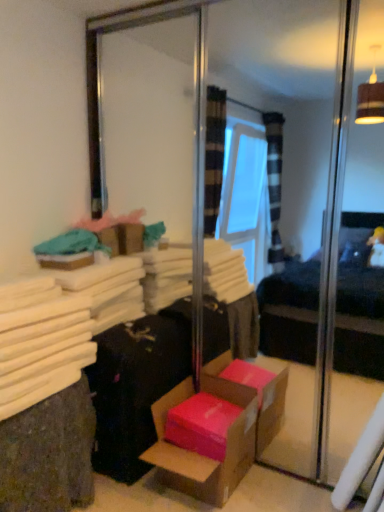
Question: Considering the positions of black fabric suitcase at lower left and white fabric at left in the image, is black fabric suitcase at lower left wider or thinner than white fabric at left?

Choices:
 (A) thin
 (B) wide

Answer: (A)

Question: From the image's perspective, is black fabric suitcase at lower left above or below white fabric at left?

Choices:
 (A) above
 (B) below

Answer: (A)

Question: Which is farther from the black fabric suitcase at lower left?

Choices:
 (A) pink cardboard box at lower center
 (B) white fabric at left

Answer: (B)

Question: Which object is the closest to the white fabric at left?

Choices:
 (A) pink cardboard box at lower center
 (B) black fabric suitcase at lower left

Answer: (B)